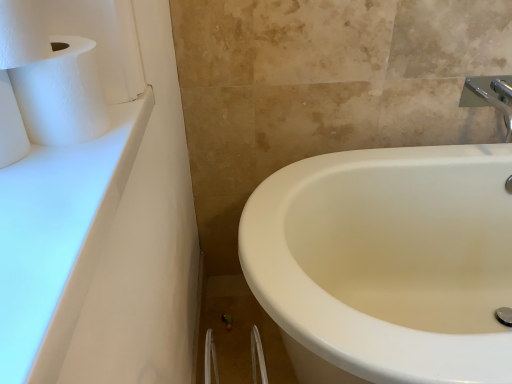
Question: From the image's perspective, is white matte toilet paper at left, which is the 2th toilet paper in top-to-bottom order, located above or below white matte paper towel at upper left?

Choices:
 (A) above
 (B) below

Answer: (B)

Question: Is white matte toilet paper at left, the 1th toilet paper when ordered from bottom to top, situated inside white matte paper towel at upper left or outside?

Choices:
 (A) outside
 (B) inside

Answer: (A)

Question: Based on their relative distances, which object is nearer to the white textured toilet paper at upper left, the second toilet paper from the bottom?

Choices:
 (A) silver metallic faucet at upper right
 (B) white matte toilet paper at left, the 1th toilet paper when ordered from bottom to top
 (C) white matte paper towel at upper left
 (D) white glossy countertop at upper left

Answer: (C)

Question: Which object is positioned closest to the white textured toilet paper at upper left, the 1th toilet paper from the top?

Choices:
 (A) white matte paper towel at upper left
 (B) white glossy countertop at upper left
 (C) white matte toilet paper at left, the 1th toilet paper when ordered from bottom to top
 (D) silver metallic faucet at upper right

Answer: (A)